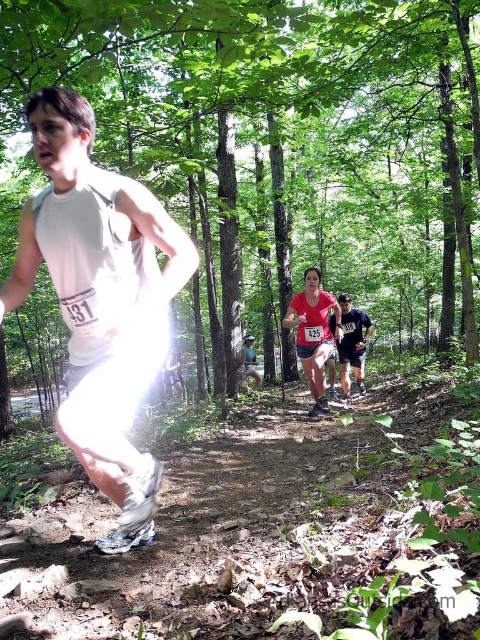
You are a photographer positioned at the camera. You want to capture a closeup shot of the white matte shorts at center. Considering the distance, will you need to adjust your zoom lens to get a clear image?

The white matte shorts at center is 6.22 feet from camera. To capture a closeup, you would need to zoom in to ensure the subject fills the frame appropriately at that distance.

You are a drone operator trying to capture aerial footage of the runners in the forest trail. You have two points marked on your screen for adjusting the camera angle. The first point is at coordinates point (93, 220) and the second is at point (364, 349). Which point should you focus on to get a closer shot of the runners?

Point (93, 220) is closer to the viewer than point (364, 349), so focusing on point (93, 220) will provide a closer shot of the runners.

You are a photographer positioned at the starting line of the trail run. You want to capture a photo that includes both the matte pink tank top at center and the dark blue jersey at center. Considering their sizes, which one should you adjust your camera focus to prioritize to ensure both are in frame?

The matte pink tank top at center is smaller than the dark blue jersey at center, so you should focus on the dark blue jersey at center first to ensure both are in frame since it is larger and might require more space.